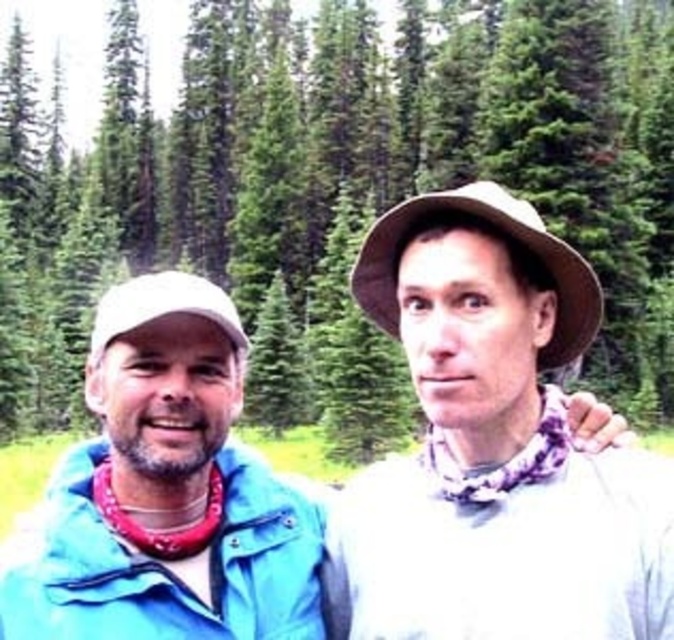
You are a photographer standing 2 meters away from the two people in the image. You want to take a photo that includes both the blue fabric jacket at center and the blue fabric jacket at left in the same frame. Given that your camera has a 1.5 meter field of view, can you capture both jackets in a single shot without moving?

The blue fabric jacket at center and blue fabric jacket at left are 1.36 meters apart from each other. Since your camera has a 1.5 meter field of view, which is wider than the distance between the jackets, you can capture both jackets in a single shot without moving.